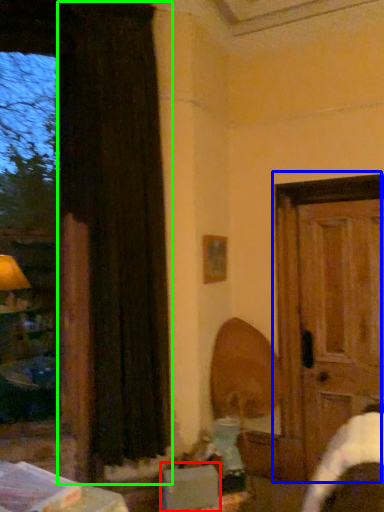
Question: Which object is the closest to the cardboard box (highlighted by a red box)? Choose among these: door (highlighted by a blue box) or curtain (highlighted by a green box).

Choices:
 (A) door
 (B) curtain

Answer: (B)